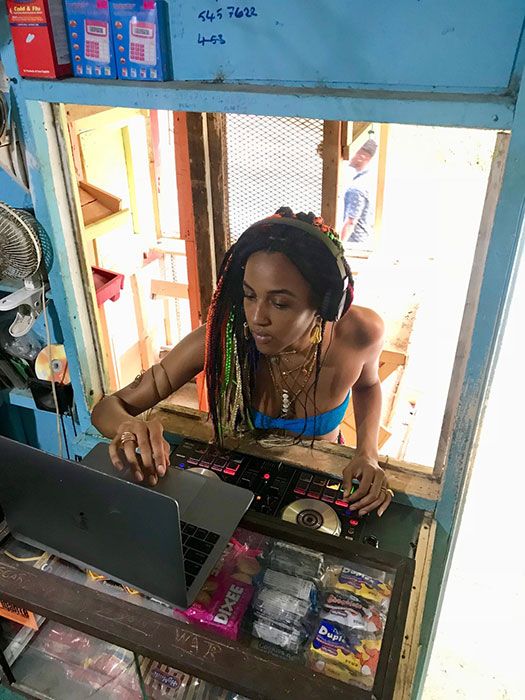
The width and height of the screenshot is (525, 700). Identify the location of laptop. (144, 564).